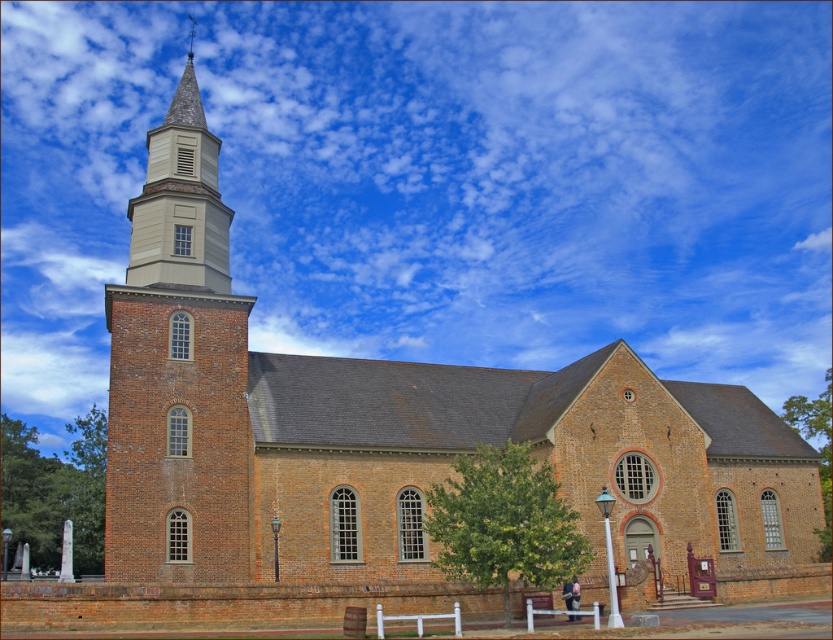
What is the spatial relationship between the brick steeple at left and the light beige wood bell tower at upper center in the historic church image?

The brick steeple at left is positioned in front of the light beige wood bell tower at upper center, meaning the steeple is closer to the viewer while the bell tower is further back.

You are standing in front of the historic brick church and notice two points marked on the ground. The first point is at coordinates point (181, 372) and the second point is at point (143, 236). Which of these two points is closer to you?

Point (181, 372) is in front of point (143, 236), so it is closer to you.

Based on the photo, you are a photographer planning to capture the church from a specific angle. You want to ensure that the brick steeple at left and the light beige wood bell tower at upper center are both visible in your shot. Based on their sizes, which one will appear bigger in the photo?

The brick steeple at left will appear bigger in the photo because it has a larger size compared to the light beige wood bell tower at upper center.